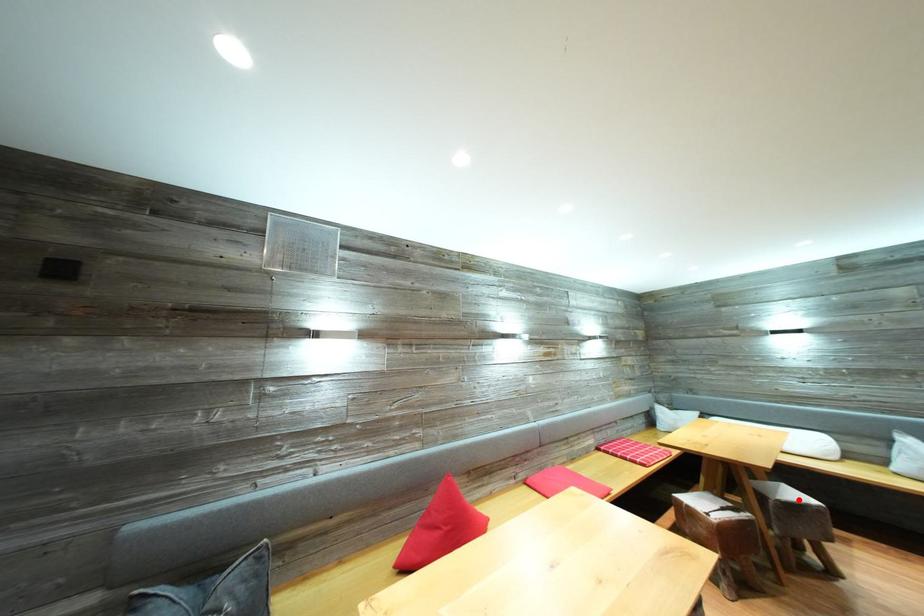
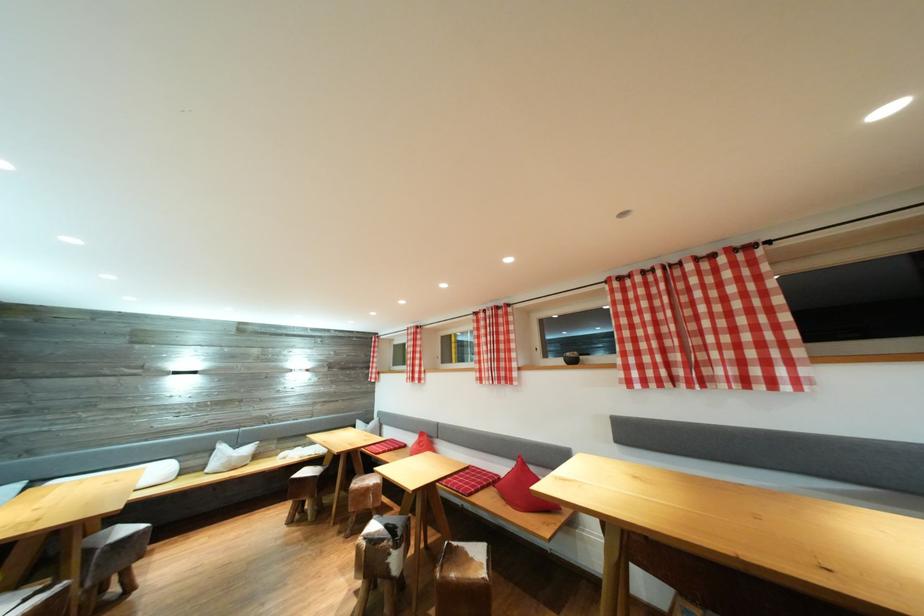
In the second image, find the point that corresponds to the highlighted location in the first image.

(131, 536)